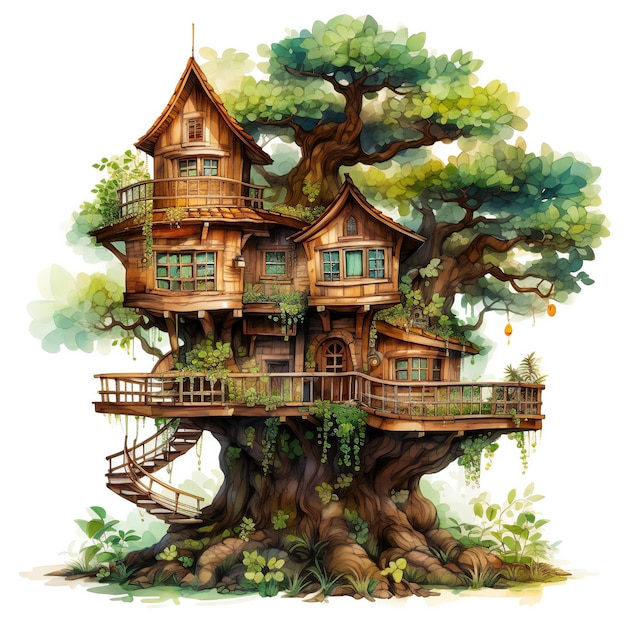
You are a GUI agent. You are given a task and a screenshot of the screen. Output one action in this format:
    pyautogui.click(x=<x>, y=<y>)
    Task: Click on the green hanging plants
    This screenshot has height=626, width=626.
    Given the screenshot: What is the action you would take?
    pyautogui.click(x=205, y=352), pyautogui.click(x=337, y=419), pyautogui.click(x=488, y=444), pyautogui.click(x=424, y=309), pyautogui.click(x=298, y=312)